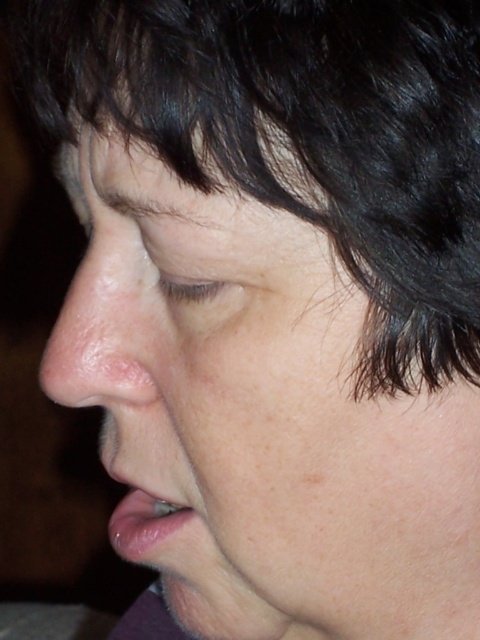
Does smooth skin nose at center appear over glossy pink lips at lower left?

Correct, smooth skin nose at center is located above glossy pink lips at lower left.

How distant is smooth skin nose at center from glossy pink lips at lower left?

They are 7.04 centimeters apart.

This screenshot has width=480, height=640. In order to click on smooth skin nose at center in this screenshot , I will do tap(105, 324).